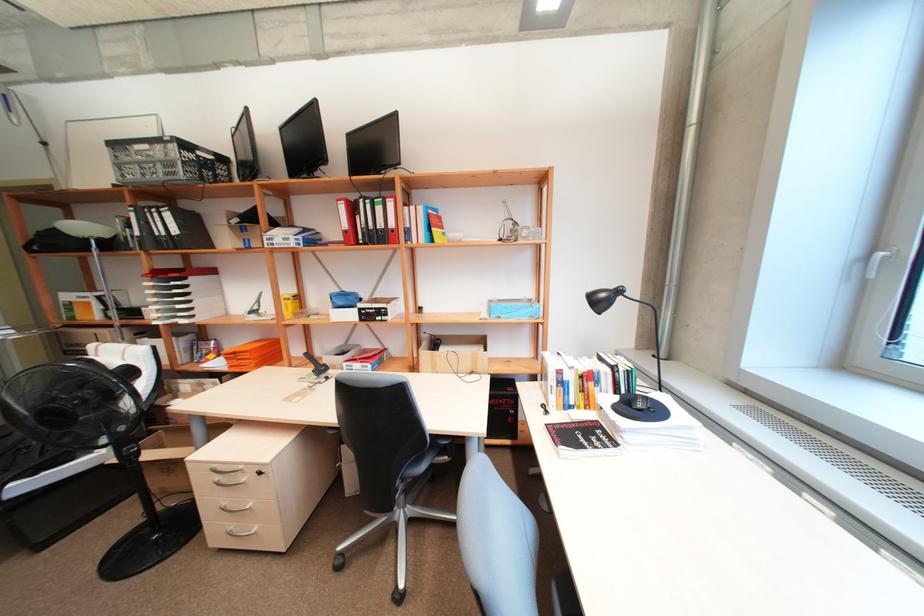
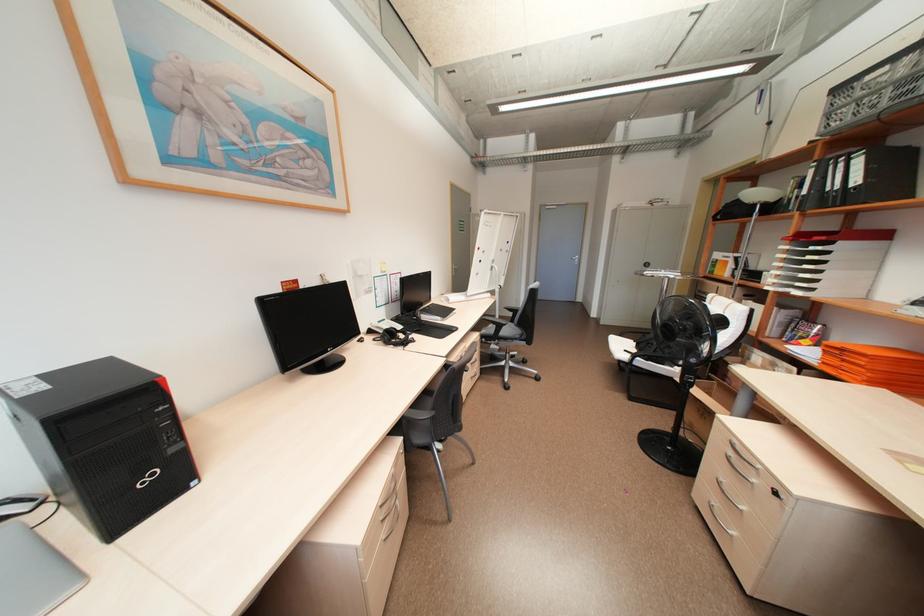
The images are taken continuously from a first-person perspective. In which direction is your viewpoint rotating?

The rotation direction of the camera is left-down.